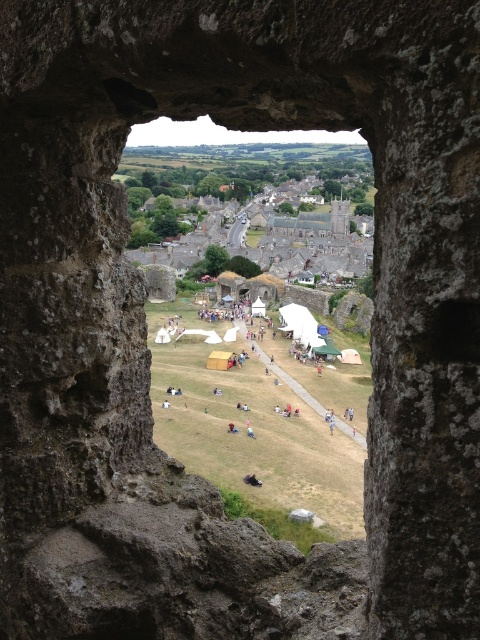
You are standing at the bottom of the stone window frame and want to see the light blue fabric person at center. Are they closer to you than the white canvas tents at center?

The white canvas tents at center are located above the light blue fabric person at center, so the light blue fabric person at center is closer to you than the white canvas tents at center.